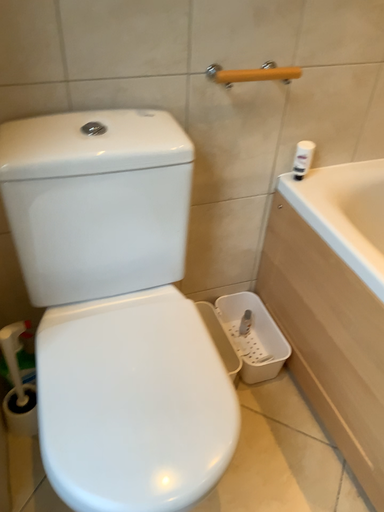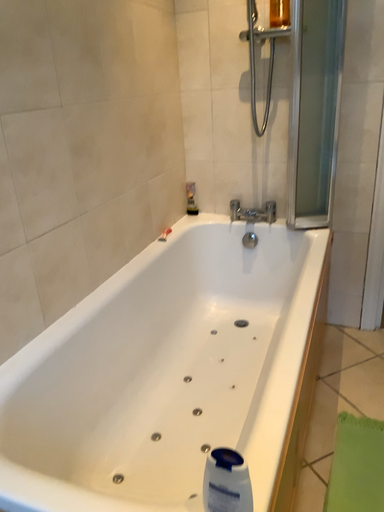
Question: Which way did the camera rotate in the video?

Choices:
 (A) rotated left
 (B) rotated right

Answer: (B)